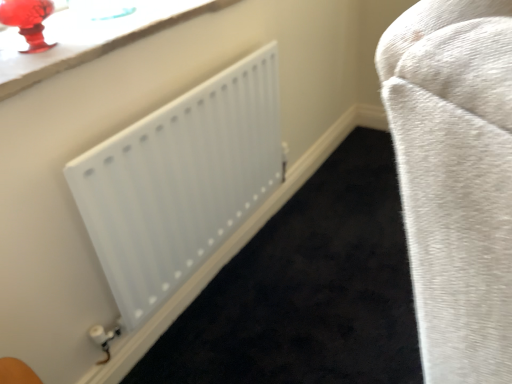
In order to face white matte radiator at center, should I rotate leftwards or rightwards?

It's best to rotate left around 5.629 degrees.

This screenshot has width=512, height=384. I want to click on white matte radiator at center, so click(180, 182).

The height and width of the screenshot is (384, 512). Describe the element at coordinates (180, 182) in the screenshot. I see `white matte radiator at center` at that location.

Image resolution: width=512 pixels, height=384 pixels. Find the location of `white matte radiator at center`. white matte radiator at center is located at coordinates (180, 182).